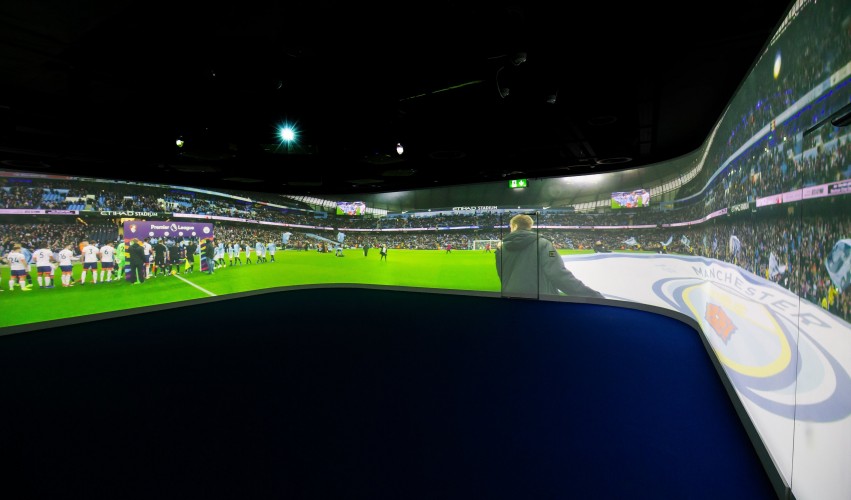
Where is `ceiling`? The image size is (851, 500). ceiling is located at coordinates (335, 66).